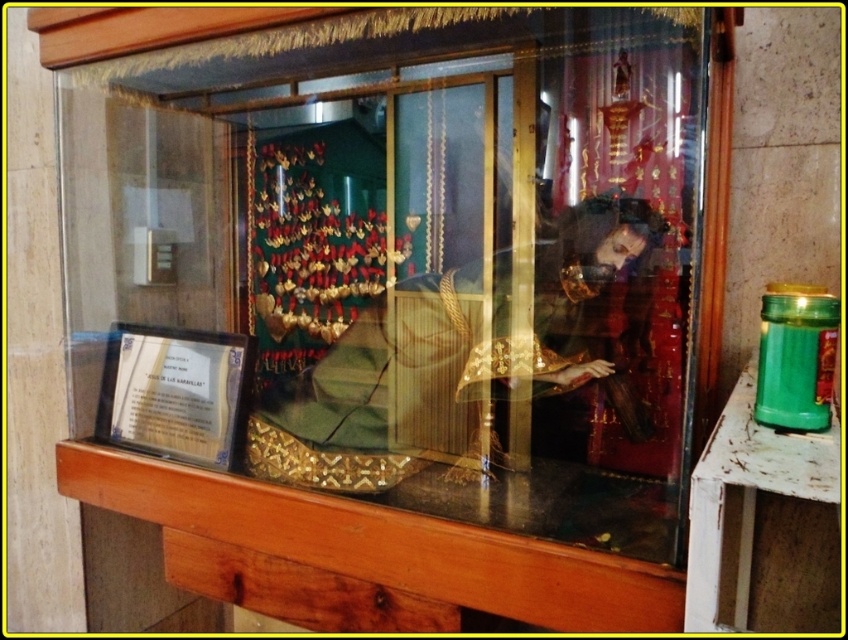
Question: Which object is closer to the camera taking this photo?

Choices:
 (A) gold textured fabric at center
 (B) transparent glass door at center
 (C) matte glass display case at center

Answer: (C)

Question: Is matte glass display case at center smaller than transparent glass door at center?

Choices:
 (A) no
 (B) yes

Answer: (A)

Question: Among these points, which one is farthest from the camera?

Choices:
 (A) (353, 202)
 (B) (530, 323)
 (C) (399, 406)

Answer: (A)

Question: Is matte glass display case at center to the right of gold textured fabric at center from the viewer's perspective?

Choices:
 (A) no
 (B) yes

Answer: (A)

Question: Which object appears farthest from the camera in this image?

Choices:
 (A) matte glass display case at center
 (B) transparent glass door at center

Answer: (B)

Question: Can you confirm if matte glass display case at center is positioned to the left of transparent glass door at center?

Choices:
 (A) yes
 (B) no

Answer: (A)